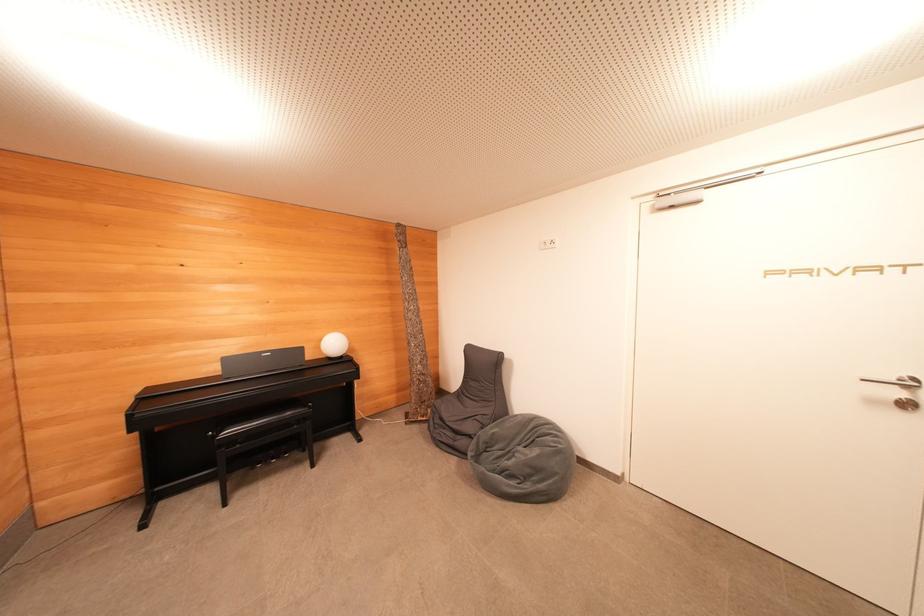
Find where to plugg the white wall outlet. Please return your answer as a coordinate pair (x, y).

(546, 244)